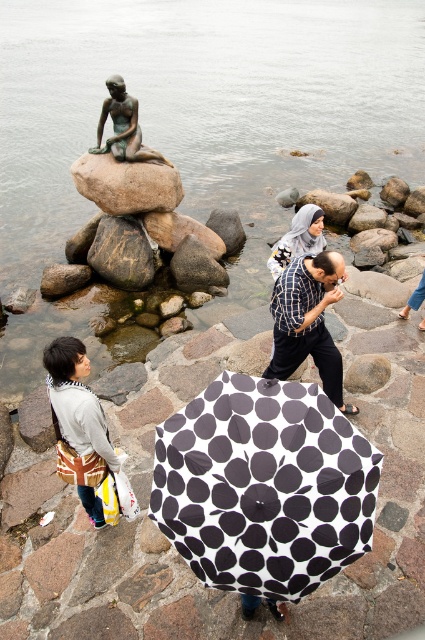
Describe the element at coordinates (308, 321) in the screenshot. I see `plaid shirt at center` at that location.

Looking at this image, is plaid shirt at center wider than brown rock at center?

Incorrect, plaid shirt at center's width does not surpass brown rock at center's.

Who is more distant from viewer, (325,278) or (164,179)?

The point (164,179) is behind.

Locate an element on the screen. The image size is (425, 640). plaid shirt at center is located at coordinates (308, 321).

Can you confirm if plaid shirt at center is bigger than white textured hijab at center?

Yes, plaid shirt at center is bigger than white textured hijab at center.

Can you confirm if plaid shirt at center is smaller than white textured hijab at center?

No, plaid shirt at center is not smaller than white textured hijab at center.

At what (x,y) coordinates should I click in order to perform the action: click on plaid shirt at center. Please return your answer as a coordinate pair (x, y). This screenshot has width=425, height=640. Looking at the image, I should click on (308, 321).

Locate an element on the screen. plaid shirt at center is located at coordinates (308, 321).

Who is higher up, gray fabric bag at lower left or bronze statue at upper left?

Positioned higher is bronze statue at upper left.

Is gray fabric bag at lower left above bronze statue at upper left?

Actually, gray fabric bag at lower left is below bronze statue at upper left.

Where is `gray fabric bag at lower left`? Image resolution: width=425 pixels, height=640 pixels. gray fabric bag at lower left is located at coordinates (79, 424).

The height and width of the screenshot is (640, 425). Identify the location of gray fabric bag at lower left. (79, 424).